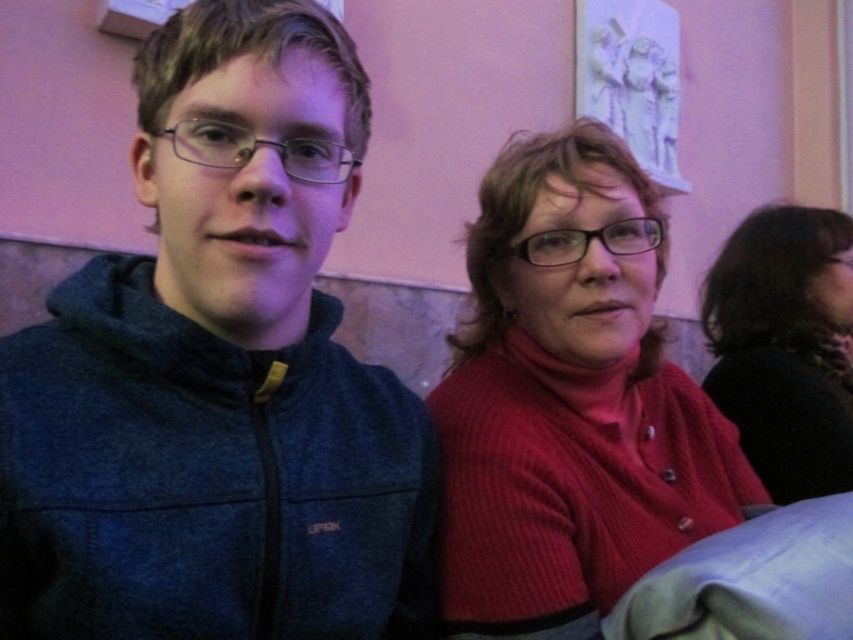
Can you confirm if matte red sweater at center is positioned to the right of black sweater at right?

Incorrect, matte red sweater at center is not on the right side of black sweater at right.

Which is more to the right, matte red sweater at center or black sweater at right?

black sweater at right

Is point (718, 512) behind point (775, 234)?

No, it is in front of (775, 234).

Where is `matte red sweater at center`? The height and width of the screenshot is (640, 853). matte red sweater at center is located at coordinates (570, 401).

Is dark blue fleece jacket at left thinner than matte red sweater at center?

Yes.

Who is more distant from viewer, (432, 449) or (619, 589)?

The point (619, 589) is more distant.

Locate an element on the screen. dark blue fleece jacket at left is located at coordinates (219, 374).

Is dark blue fleece jacket at left bigger than black sweater at right?

No.

Who is higher up, dark blue fleece jacket at left or black sweater at right?

Positioned higher is black sweater at right.

Which is behind, point (376, 586) or point (730, 362)?

The point (730, 362) is behind.

The height and width of the screenshot is (640, 853). What are the coordinates of `dark blue fleece jacket at left` in the screenshot? It's located at (219, 374).